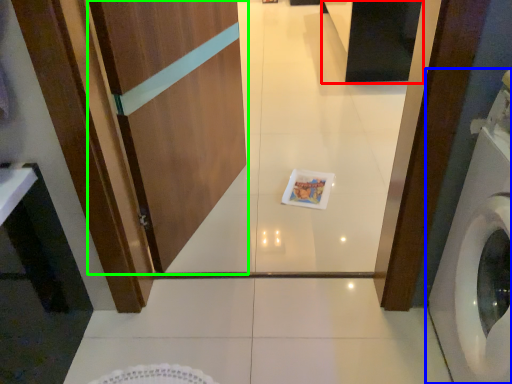
Question: Which is nearer to the cabinetry (highlighted by a red box)? washing machine (highlighted by a blue box) or screen door (highlighted by a green box).

Choices:
 (A) washing machine
 (B) screen door

Answer: (B)